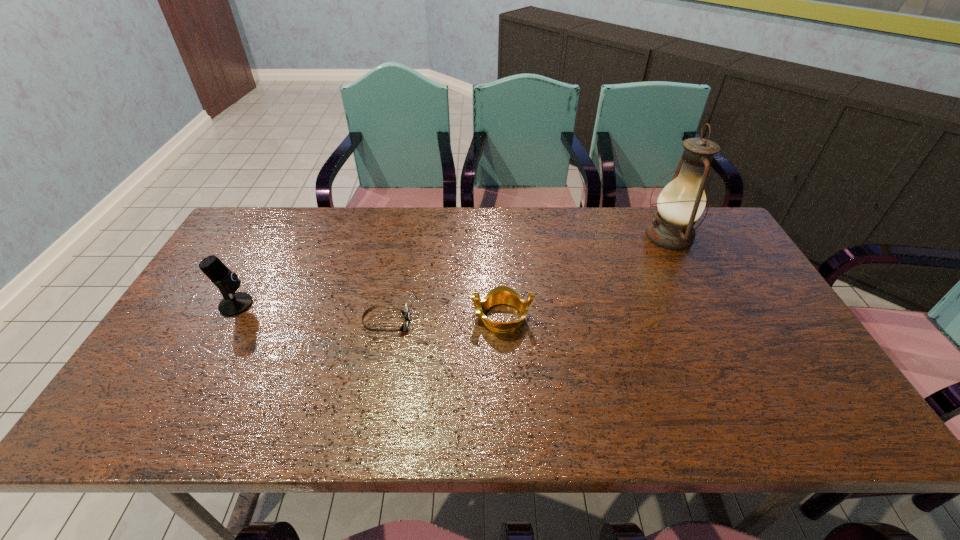
Where is `vacant area between the second shortest object and the oil lamp`? vacant area between the second shortest object and the oil lamp is located at coordinates (586, 276).

Image resolution: width=960 pixels, height=540 pixels. I want to click on empty space that is in between the shortest object and the tiara, so click(x=444, y=320).

This screenshot has width=960, height=540. What are the coordinates of `free space between the second object from left to right and the second shortest object` in the screenshot? It's located at pos(444,320).

You are a GUI agent. You are given a task and a screenshot of the screen. Output one action in this format:
    pyautogui.click(x=<x>, y=<y>)
    Task: Click on the vacant area that lies between the third object from left to right and the goggles
    This screenshot has height=540, width=960.
    Given the screenshot: What is the action you would take?
    pyautogui.click(x=444, y=320)

At what (x,y) coordinates should I click in order to perform the action: click on the closest object to the second object from left to right. Please return your answer as a coordinate pair (x, y). Image resolution: width=960 pixels, height=540 pixels. Looking at the image, I should click on (502, 294).

The width and height of the screenshot is (960, 540). Find the location of `object that is the second closest one to the third tallest object`. object that is the second closest one to the third tallest object is located at coordinates (682, 201).